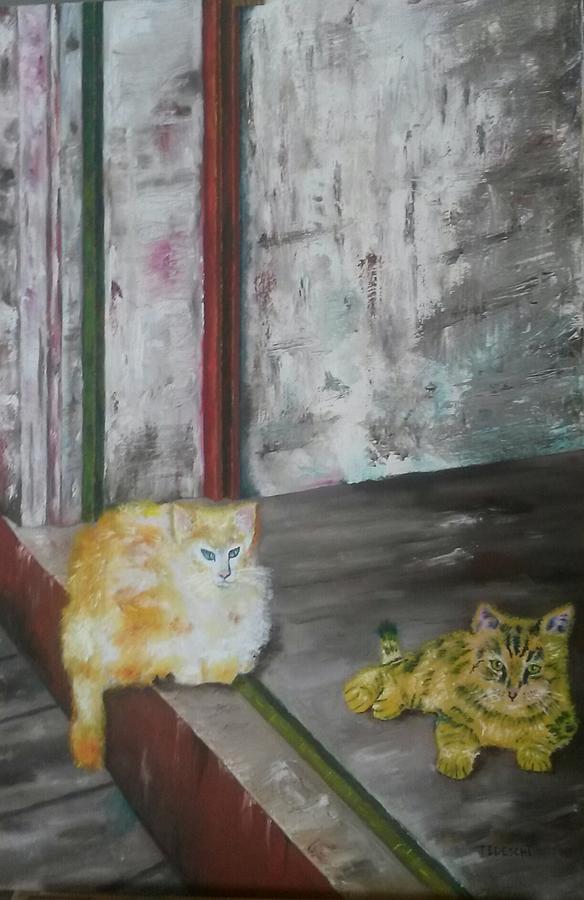
Where is `rectangular painting of cats`? Image resolution: width=584 pixels, height=900 pixels. rectangular painting of cats is located at coordinates [x=15, y=13].